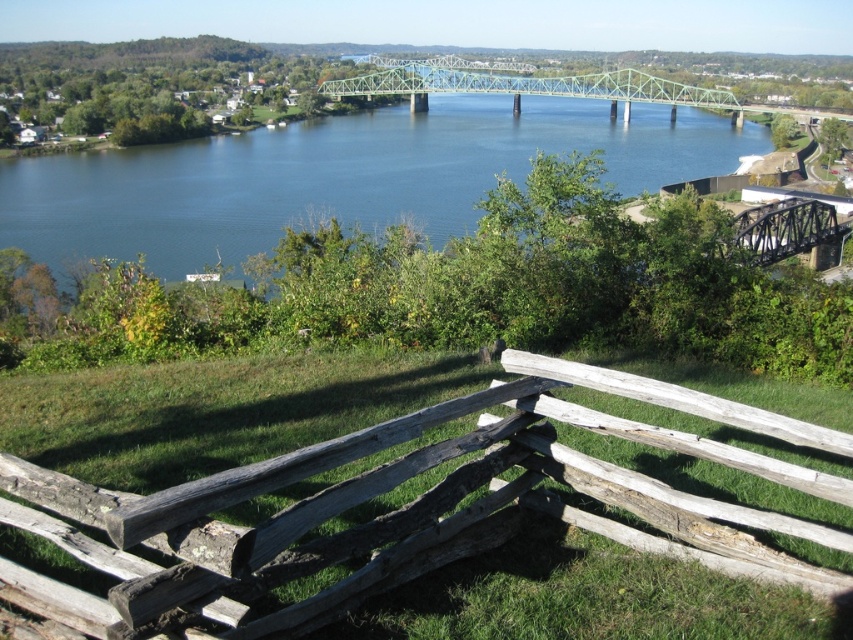
You are a painter setting up your easel to capture the scene. You want to ensure both the weathered wood fence at lower center and the green metallic bridge at center are visible in your painting. Given their sizes, which object should you place closer to the foreground to maintain their visibility?

The weathered wood fence at lower center occupies less space than the green metallic bridge at center, so to maintain visibility of both, you should place the weathered wood fence at lower center closer to the foreground since it is smaller and needs to be emphasized.

You are standing at the point marked by the coordinate (173, 438) in the image. Based on the scene description, what object are you most likely standing on or near?

The point marked by the coordinate (173, 438) is on the weathered wood fence at lower center, so you are most likely standing on or near the weathered wood fence at lower center.

You are standing at the center of the image and want to walk towards the weathered wood fence at lower center. Which direction should you move to reach it?

Since the weathered wood fence at lower center is located at point (173,438), you should move downward and to the right to reach it.